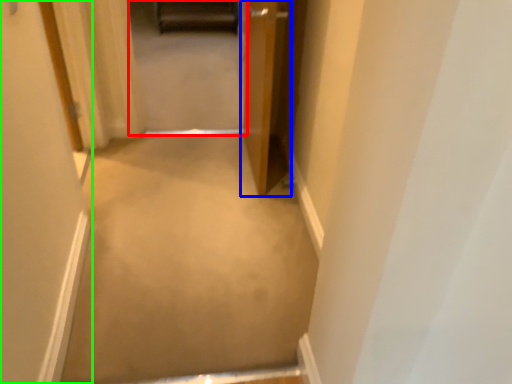
Question: Estimate the real-world distances between objects in this image. Which object is farther from passage (highlighted by a red box), door (highlighted by a blue box) or door (highlighted by a green box)?

Choices:
 (A) door
 (B) door

Answer: (B)